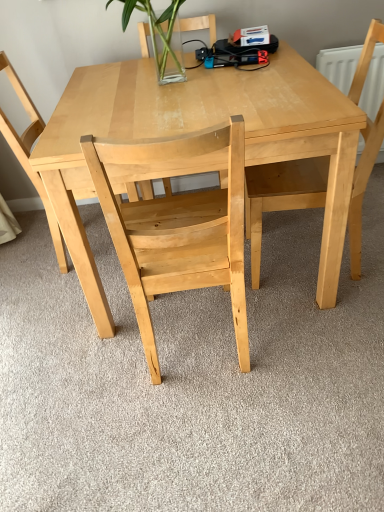
What are the coordinates of `vacant area that lies between natural wood chair at center, the 2th chair viewed from the left, and natural wood table at center` in the screenshot? It's located at (264, 342).